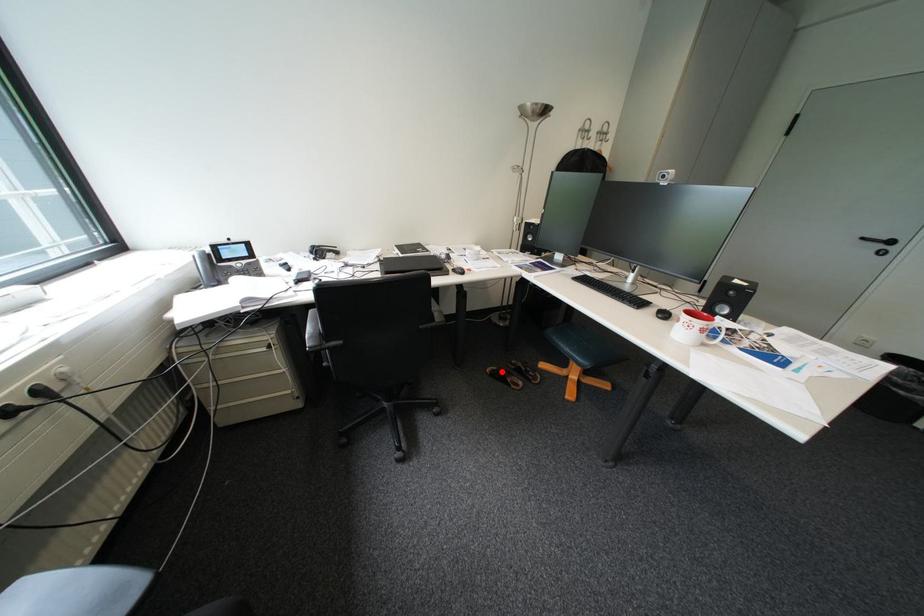
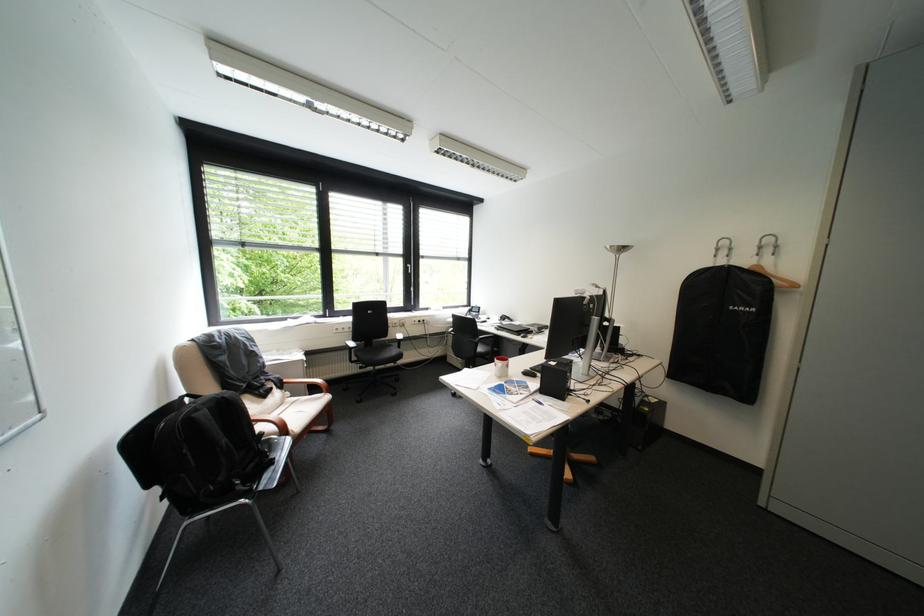
Question: I am providing you with two images of the same scene from different viewpoints. A red point is marked on the first image. Is the red point's position out of view in image 2?

Choices:
 (A) Yes
 (B) No

Answer: (A)